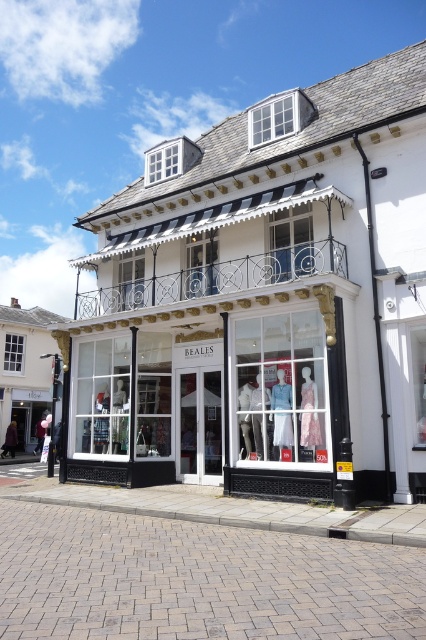
Question: Is white glass storefront at center smaller than matte glass mannequins at center?

Choices:
 (A) no
 (B) yes

Answer: (A)

Question: Can you confirm if white glass storefront at center is bigger than matte glass mannequins at center?

Choices:
 (A) no
 (B) yes

Answer: (B)

Question: Which point is farther to the camera?

Choices:
 (A) (98, 358)
 (B) (247, 428)

Answer: (A)

Question: Where is white glass storefront at center located in relation to matte glass mannequins at center in the image?

Choices:
 (A) right
 (B) left

Answer: (B)